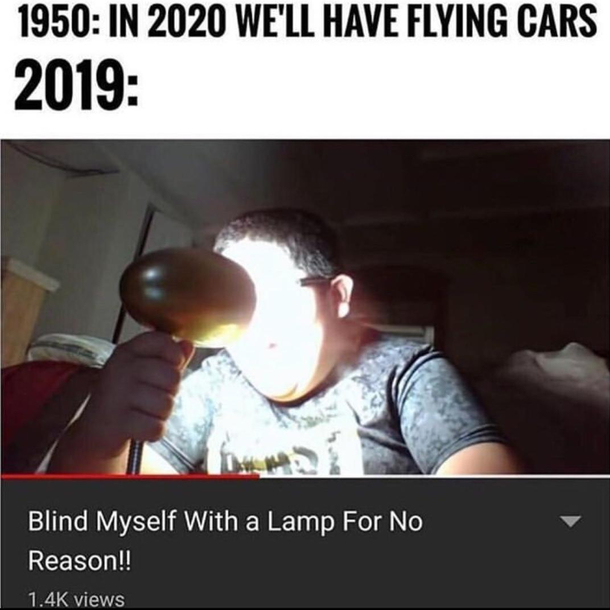
Where is `lamp`? Image resolution: width=610 pixels, height=610 pixels. lamp is located at coordinates (209, 305), (134, 454), (166, 329).